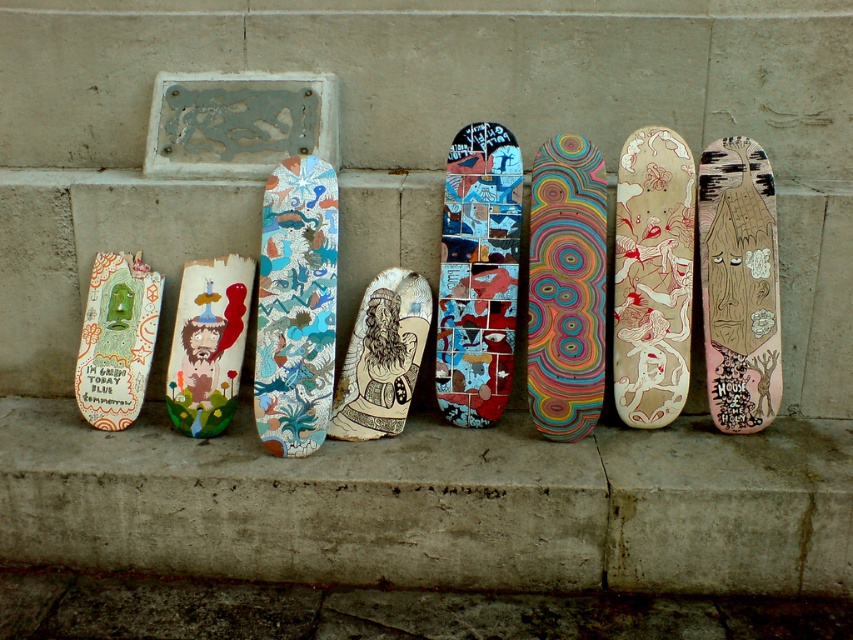
You are a skateboarder who wants to choose a skateboard that is taller between the beige wood skateboard at center and the matte wooden skateboard at center. Which one should you pick?

The beige wood skateboard at center is much taller than the matte wooden skateboard at center, so you should pick the beige wood skateboard at center.

You are standing in front of a wall with several skateboards leaning against it. You see a beige wood skateboard at center. If you want to reach it without moving any other skateboards, can you do so? Please explain your reasoning based on the distance provided.

The beige wood skateboard at center is 2.73 meters away from the camera. Since the distance is quite far, it might be difficult to reach without moving other skateboards unless you have a long tool or extendable grabber. However, the description does not mention the arrangement of the other skateboards, so we cannot confirm if they block the path.

You are standing in front of the wall where the skateboards are leaning. You need to find the beige wood skateboard at center. According to the coordinates provided, where exactly is it positioned?

The beige wood skateboard at center is located at point coordinates (653, 276).